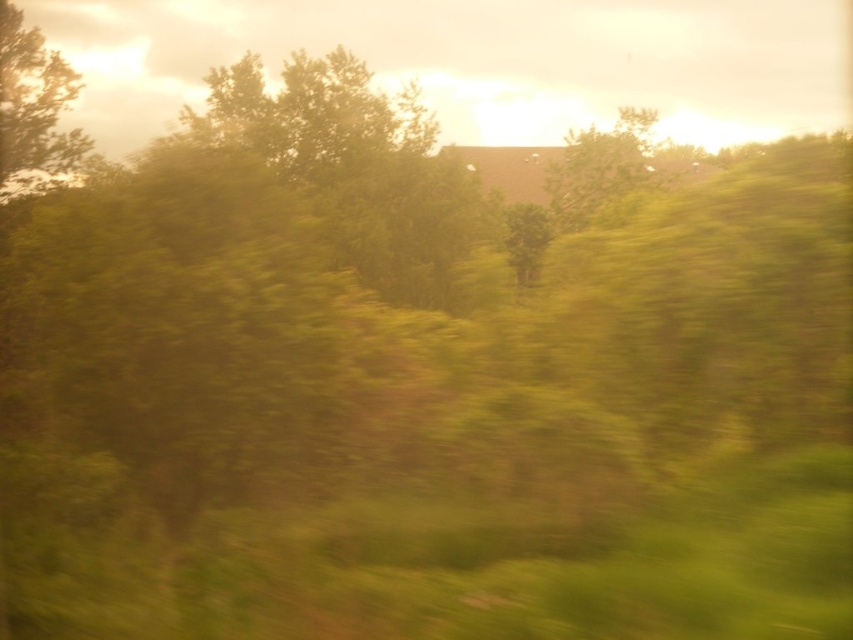
In the scene shown: You are a passenger in a train and looking out the window. You notice two green leafy trees in the scene. Which one is closer to the train, the green leafy tree at upper left or the green leafy tree at center?

The green leafy tree at upper left is closer to the train because it is shorter than the green leafy tree at center, and in perspective, closer objects appear smaller.

You are a passenger on a train and looking out the window. You see a green leafy tree at upper left and a green leafy tree at center. Which tree is positioned lower in the view?

The green leafy tree at upper left is positioned lower than the green leafy tree at center in the view.

You are standing at the point labeled point (54, 100) in the image. If you want to walk towards the train tracks that are 24.74 meters behind you, will you need to walk through any trees or structures?

The point labeled point (54, 100) is 24.74 meters away from the viewer. Since the train tracks are behind you and the distance matches the separation between you and the point, you would be facing away from the tracks. Therefore, walking towards the tracks would require moving in the opposite direction, and the presence of trees or structures isn t mentioned in the scene description, so it s unclear if obstacles exist.